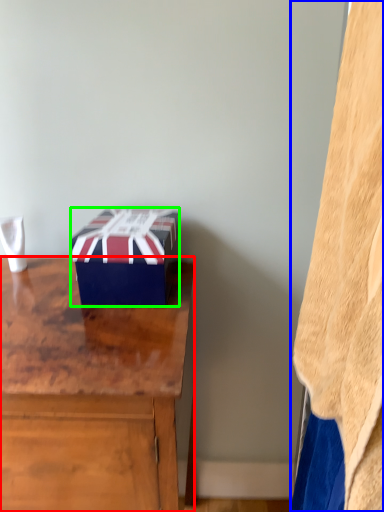
Question: Which object is positioned closest to desk (highlighted by a red box)? Select from blanket (highlighted by a blue box) and box (highlighted by a green box).

Choices:
 (A) blanket
 (B) box

Answer: (B)